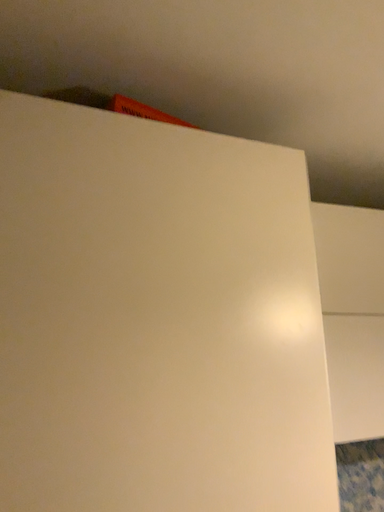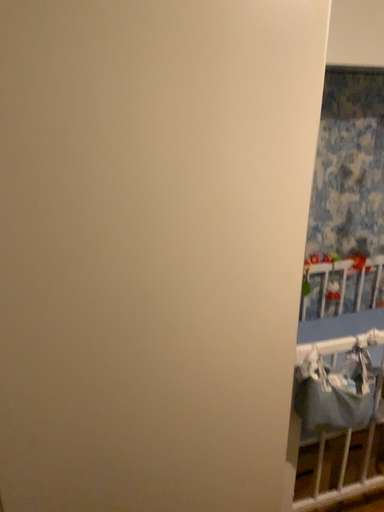
Question: Which way did the camera rotate in the video?

Choices:
 (A) rotated upward
 (B) rotated downward

Answer: (B)